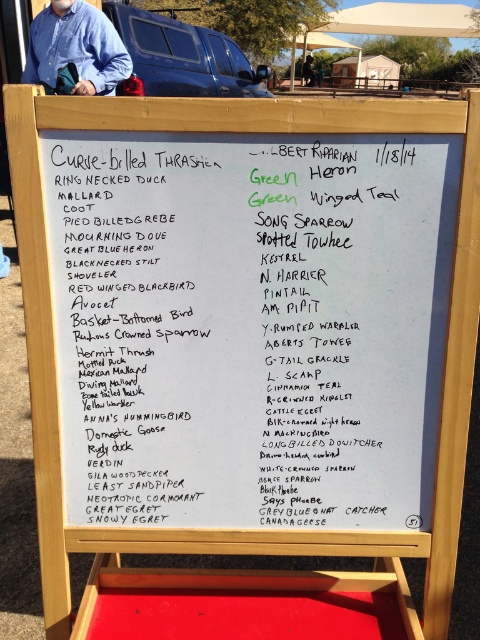
Is point (321, 289) positioned in front of point (108, 28)?

Yes, it is in front of point (108, 28).

Does green paper at upper center have a larger size compared to blue cotton shirt at upper left?

No, green paper at upper center is not bigger than blue cotton shirt at upper left.

Is point (411, 173) behind point (113, 76)?

No.

This screenshot has height=640, width=480. What are the coordinates of `green paper at upper center` in the screenshot? It's located at (339, 333).

Can you confirm if white paperboard menu at upper center is thinner than blue shirt at upper left?

Incorrect, white paperboard menu at upper center's width is not less than blue shirt at upper left's.

Between point (54, 289) and point (308, 68), which one is positioned behind?

Positioned behind is point (308, 68).

Does point (371, 368) come closer to viewer compared to point (305, 61)?

Yes, it is.

Identify the location of white paperboard menu at upper center. (250, 324).

Looking at this image, is white paperboard menu at upper center positioned in front of green paper at upper center?

Yes, it is in front of green paper at upper center.

Who is positioned more to the right, white paperboard menu at upper center or green paper at upper center?

Positioned to the right is green paper at upper center.

Is point (325, 509) farther from camera compared to point (323, 218)?

Yes.

Find the location of a particular element. white paperboard menu at upper center is located at coordinates (250, 324).